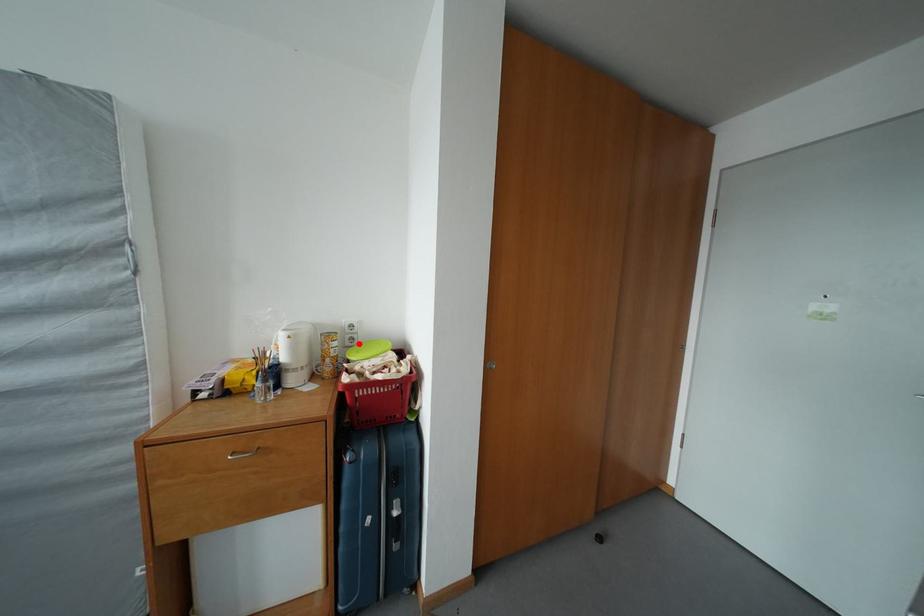
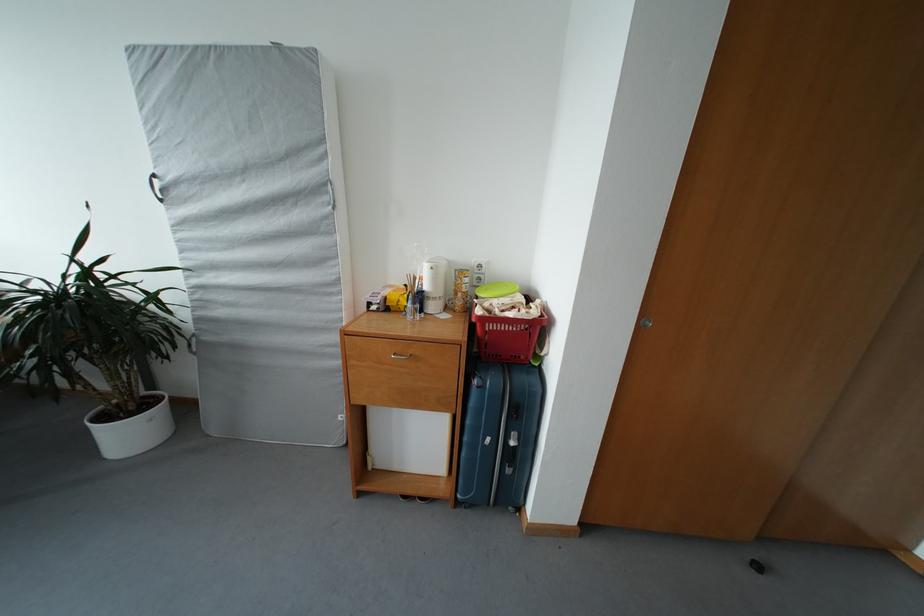
In the second image, find the point that corresponds to the highlighted location in the first image.

(485, 284)